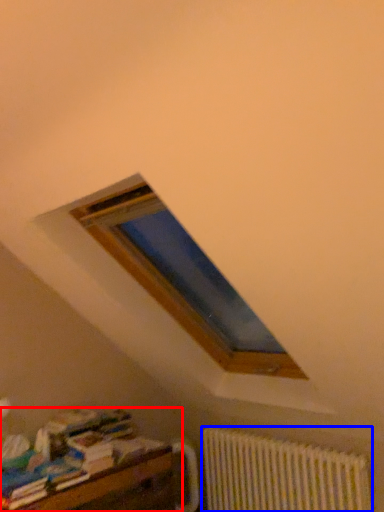
Question: Which point is further to the camera, furniture (highlighted by a red box) or radiator (highlighted by a blue box)?

Choices:
 (A) furniture
 (B) radiator

Answer: (B)